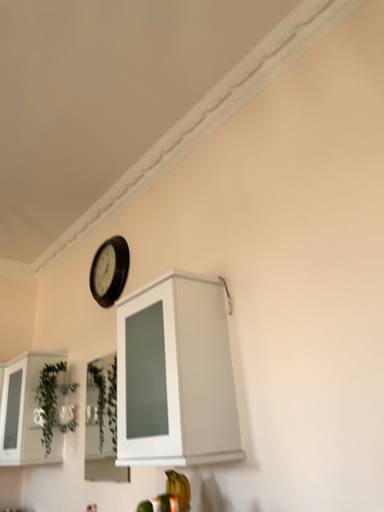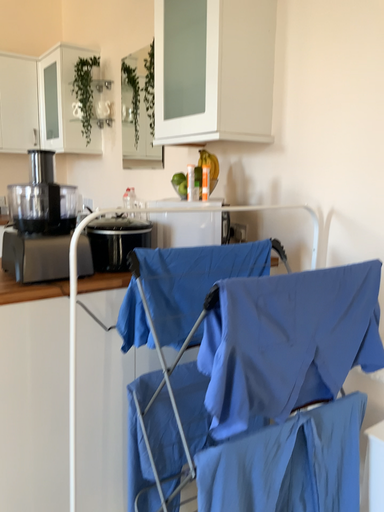
Question: How did the camera likely rotate when shooting the video?

Choices:
 (A) rotated upward
 (B) rotated downward

Answer: (B)